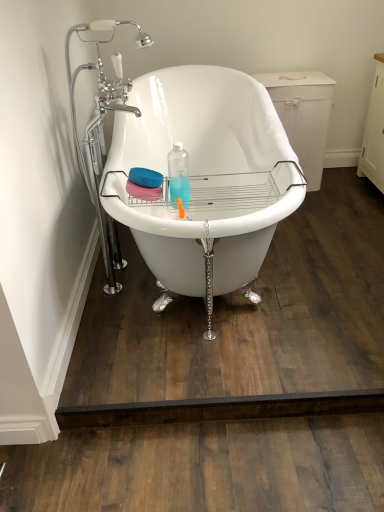
Question: Should I look upward or downward to see white glossy bathtub at center?

Choices:
 (A) up
 (B) down

Answer: (A)

Question: Considering the relative sizes of white glossy bathtub at center and chrome/metallic faucet at upper left in the image provided, is white glossy bathtub at center taller than chrome/metallic faucet at upper left?

Choices:
 (A) yes
 (B) no

Answer: (B)

Question: Is white glossy bathtub at center further to the viewer compared to chrome/metallic faucet at upper left?

Choices:
 (A) no
 (B) yes

Answer: (A)

Question: From the image's perspective, is white glossy bathtub at center below chrome/metallic faucet at upper left?

Choices:
 (A) yes
 (B) no

Answer: (A)

Question: Is white glossy bathtub at center outside chrome/metallic faucet at upper left?

Choices:
 (A) yes
 (B) no

Answer: (A)

Question: From a real-world perspective, is white glossy bathtub at center beneath chrome/metallic faucet at upper left?

Choices:
 (A) yes
 (B) no

Answer: (A)

Question: Is white glossy bathtub at center to the right of chrome/metallic faucet at upper left from the viewer's perspective?

Choices:
 (A) yes
 (B) no

Answer: (A)

Question: Does chrome/metallic faucet at upper left have a greater height compared to white glossy bathtub at center?

Choices:
 (A) no
 (B) yes

Answer: (B)

Question: Is white glossy bathtub at center at the back of chrome/metallic faucet at upper left?

Choices:
 (A) no
 (B) yes

Answer: (B)

Question: Does chrome/metallic faucet at upper left turn towards white glossy bathtub at center?

Choices:
 (A) yes
 (B) no

Answer: (A)

Question: Is chrome/metallic faucet at upper left positioned before white glossy bathtub at center?

Choices:
 (A) yes
 (B) no

Answer: (B)

Question: Is white glossy bathtub at center completely or partially inside chrome/metallic faucet at upper left?

Choices:
 (A) yes
 (B) no

Answer: (B)

Question: From a real-world perspective, is chrome/metallic faucet at upper left physically above white glossy bathtub at center?

Choices:
 (A) yes
 (B) no

Answer: (A)

Question: Looking at their shapes, would you say white glossy bathtub at center is wider or thinner than chrome/metallic faucet at upper left?

Choices:
 (A) thin
 (B) wide

Answer: (B)